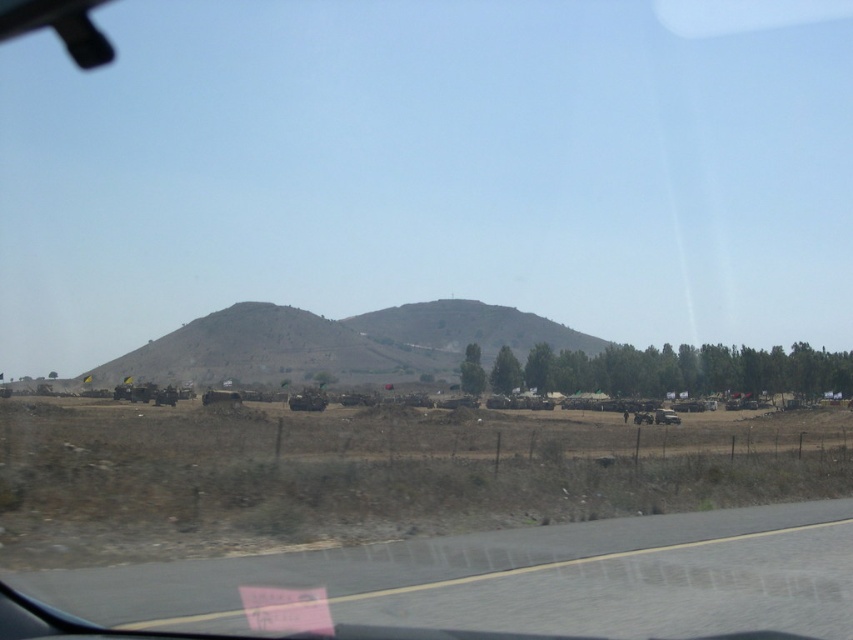
Question: Among these objects, which one is farthest from the camera?

Choices:
 (A) gray asphalt highway at lower center
 (B) brown textured hill at center

Answer: (B)

Question: Which point appears farthest from the camera in this image?

Choices:
 (A) (482, 342)
 (B) (196, 620)

Answer: (A)

Question: Is the position of gray asphalt highway at lower center less distant than that of brown textured hill at center?

Choices:
 (A) yes
 (B) no

Answer: (A)

Question: Is gray asphalt highway at lower center to the left of brown textured hill at center from the viewer's perspective?

Choices:
 (A) yes
 (B) no

Answer: (B)

Question: Is gray asphalt highway at lower center smaller than brown textured hill at center?

Choices:
 (A) no
 (B) yes

Answer: (B)